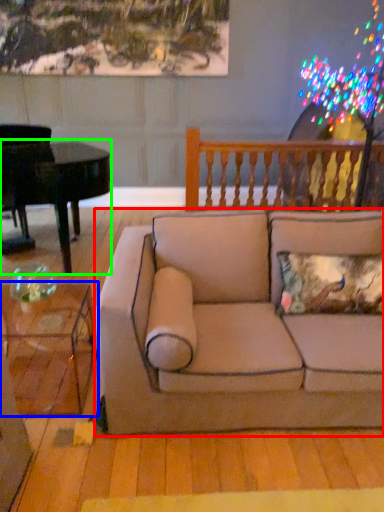
Question: Based on their relative distances, which object is nearer to studio couch (highlighted by a red box)? Choose from coffee table (highlighted by a blue box) and piano (highlighted by a green box).

Choices:
 (A) coffee table
 (B) piano

Answer: (A)